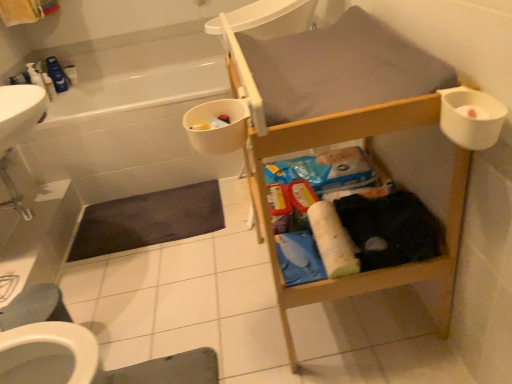
Question: Which direction should I rotate to look at matte plastic toiletries at center, arranged as the 1th toiletry when viewed from the right?

Choices:
 (A) right
 (B) left

Answer: (A)

Question: From the image's perspective, would you say white plastic cup at upper right is positioned over white glossy bathtub at upper left?

Choices:
 (A) yes
 (B) no

Answer: (B)

Question: From a real-world perspective, does white plastic cup at upper right stand above white glossy bathtub at upper left?

Choices:
 (A) no
 (B) yes

Answer: (B)

Question: Does white plastic cup at upper right have a lesser height compared to white glossy bathtub at upper left?

Choices:
 (A) yes
 (B) no

Answer: (A)

Question: Is white plastic cup at upper right not within white glossy bathtub at upper left?

Choices:
 (A) yes
 (B) no

Answer: (A)

Question: Is white plastic cup at upper right to the left of white glossy bathtub at upper left from the viewer's perspective?

Choices:
 (A) yes
 (B) no

Answer: (B)

Question: Does white plastic cup at upper right have a greater width compared to white glossy bathtub at upper left?

Choices:
 (A) yes
 (B) no

Answer: (B)

Question: Does white plastic container at upper left, the third toiletry when ordered from bottom to top, contain gray fabric bath mat at lower center, which is the first bath mat in front-to-back order?

Choices:
 (A) yes
 (B) no

Answer: (B)

Question: Can you confirm if white plastic container at upper left, acting as the first toiletry starting from the top, is wider than gray fabric bath mat at lower center, placed as the second bath mat when sorted from back to front?

Choices:
 (A) yes
 (B) no

Answer: (B)

Question: Is white plastic container at upper left, positioned as the 2th toiletry in right-to-left order, facing towards gray fabric bath mat at lower center, the 1th bath mat positioned from the bottom?

Choices:
 (A) no
 (B) yes

Answer: (A)

Question: Considering the relative sizes of white plastic container at upper left, the third toiletry when ordered from bottom to top, and gray fabric bath mat at lower center, which is the first bath mat in front-to-back order, in the image provided, is white plastic container at upper left, the third toiletry when ordered from bottom to top, thinner than gray fabric bath mat at lower center, which is the first bath mat in front-to-back order,?

Choices:
 (A) yes
 (B) no

Answer: (A)

Question: From a real-world perspective, is white plastic container at upper left, acting as the first toiletry starting from the top, positioned under gray fabric bath mat at lower center, which is the 2th bath mat from top to bottom, based on gravity?

Choices:
 (A) yes
 (B) no

Answer: (B)

Question: Considering the relative sizes of white plastic container at upper left, positioned as the 2th toiletry in right-to-left order, and gray fabric bath mat at lower center, the 1th bath mat positioned from the bottom, in the image provided, is white plastic container at upper left, positioned as the 2th toiletry in right-to-left order, taller than gray fabric bath mat at lower center, the 1th bath mat positioned from the bottom,?

Choices:
 (A) yes
 (B) no

Answer: (A)

Question: Is white plastic bidet at lower left positioned before white glossy bathtub at upper left?

Choices:
 (A) yes
 (B) no

Answer: (A)